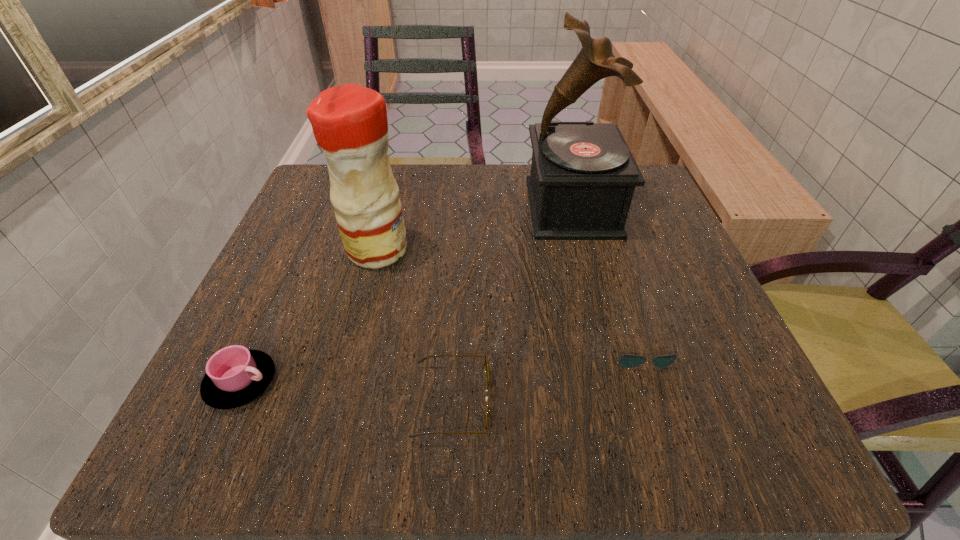
At what (x,y) coordinates should I click in order to perform the action: click on object that ranks as the closest to the left sunglasses. Please return your answer as a coordinate pair (x, y). This screenshot has width=960, height=540. Looking at the image, I should click on (627, 361).

At what (x,y) coordinates should I click in order to perform the action: click on object that is the third closest to the phonograph_record. Please return your answer as a coordinate pair (x, y). The image size is (960, 540). Looking at the image, I should click on (422, 359).

You are a GUI agent. You are given a task and a screenshot of the screen. Output one action in this format:
    pyautogui.click(x=<x>, y=<y>)
    Task: Click on the vacant space that satisfies the following two spatial constraints: 1. on the lenses of the shortest object; 2. on the side with the handle of the leftmost object
    
    Given the screenshot: What is the action you would take?
    pyautogui.click(x=650, y=382)

Image resolution: width=960 pixels, height=540 pixels. I want to click on vacant space that satisfies the following two spatial constraints: 1. on the lenses of the shorter sunglasses; 2. on the lenses of the third object from right to left, so click(656, 402).

Locate an element on the screen. Image resolution: width=960 pixels, height=540 pixels. free location that satisfies the following two spatial constraints: 1. on the lenses of the shorter sunglasses; 2. on the side with the handle of the leftmost object is located at coordinates (650, 382).